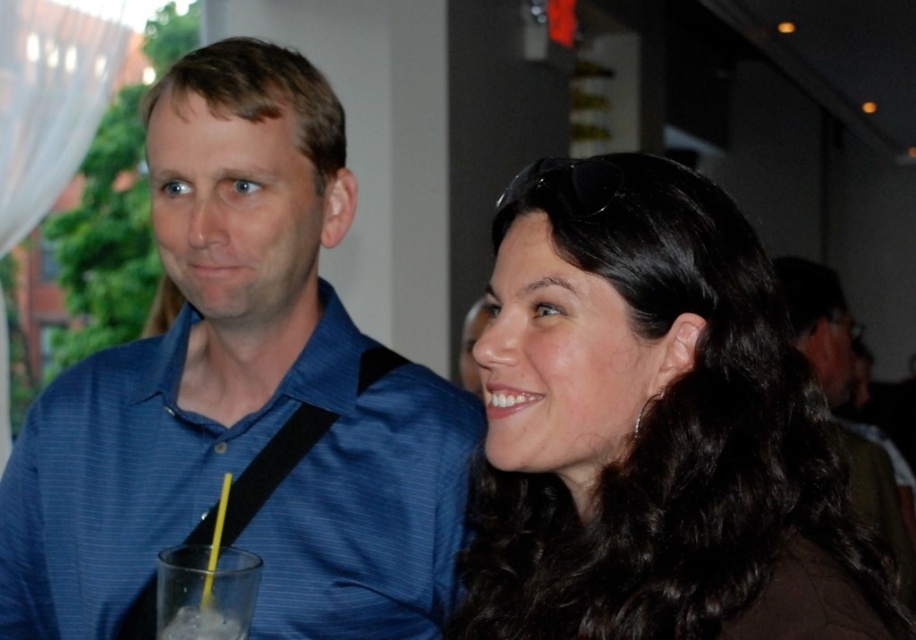
Question: Among these objects, which one is nearest to the camera?

Choices:
 (A) blue striped shirt at left
 (B) clear plastic cup at lower left

Answer: (B)

Question: Does blue striped shirt at left appear on the right side of black shiny hair at upper right?

Choices:
 (A) yes
 (B) no

Answer: (B)

Question: Which object appears farthest from the camera in this image?

Choices:
 (A) green fabric shirt at upper right
 (B) clear plastic cup at lower left
 (C) blue striped shirt at left
 (D) black shiny hair at upper right

Answer: (A)

Question: Is blue striped shirt at left in front of clear plastic cup at lower left?

Choices:
 (A) yes
 (B) no

Answer: (B)

Question: Observing the image, what is the correct spatial positioning of blue striped shirt at left in reference to black shiny hair at upper right?

Choices:
 (A) right
 (B) left

Answer: (B)

Question: Which object is the farthest from the black shiny hair at upper right?

Choices:
 (A) clear plastic cup at lower left
 (B) green fabric shirt at upper right

Answer: (B)